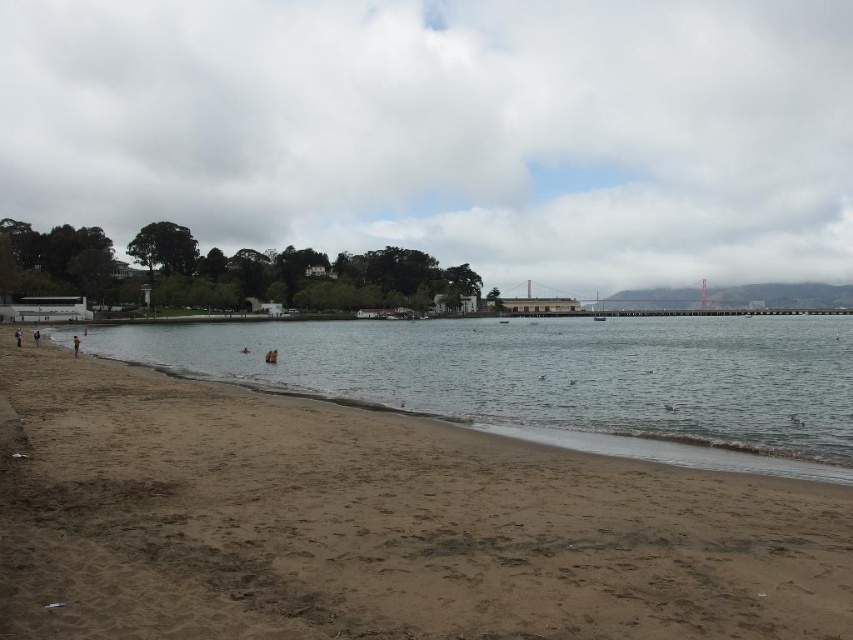
You are standing on the beach and want to take a photo of the cloudy sky at upper center and the clear water at beach left. Which object should you point your camera towards first if you want to capture both in a single shot?

You should point your camera towards the clear water at beach left first because the cloudy sky at upper center is to the right of it, allowing both to be captured in a single shot.

You are a photographer standing on the beach and want to capture a photo that includes both the cloudy sky at upper center and the clear water at beach left. Based on their positions, which object should you focus on first to ensure both are in the frame?

The cloudy sky at upper center is positioned over clear water at beach left, so you should focus on the cloudy sky at upper center first to ensure both are in the frame.